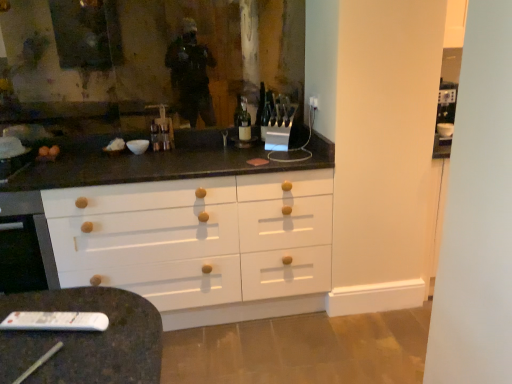
Question: From a real-world perspective, is white plastic remote at lower left positioned above or below matte glass bottle at center?

Choices:
 (A) below
 (B) above

Answer: (A)

Question: In terms of height, does white plastic remote at lower left look taller or shorter compared to matte glass bottle at center?

Choices:
 (A) short
 (B) tall

Answer: (A)

Question: Considering the relative positions of white plastic remote at lower left and matte glass bottle at center in the image provided, is white plastic remote at lower left to the left or to the right of matte glass bottle at center?

Choices:
 (A) left
 (B) right

Answer: (A)

Question: Is matte glass bottle at center inside the boundaries of white plastic remote at lower left, or outside?

Choices:
 (A) inside
 (B) outside

Answer: (B)

Question: Based on their sizes in the image, would you say matte glass bottle at center is bigger or smaller than white plastic remote at lower left?

Choices:
 (A) big
 (B) small

Answer: (A)

Question: Considering the positions of matte glass bottle at center and white plastic remote at lower left in the image, is matte glass bottle at center wider or thinner than white plastic remote at lower left?

Choices:
 (A) wide
 (B) thin

Answer: (A)

Question: From the image's perspective, is matte glass bottle at center positioned above or below white plastic remote at lower left?

Choices:
 (A) above
 (B) below

Answer: (A)